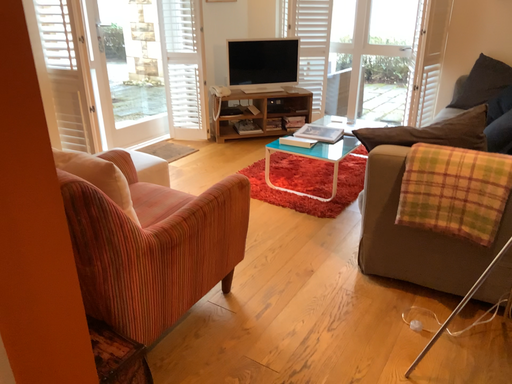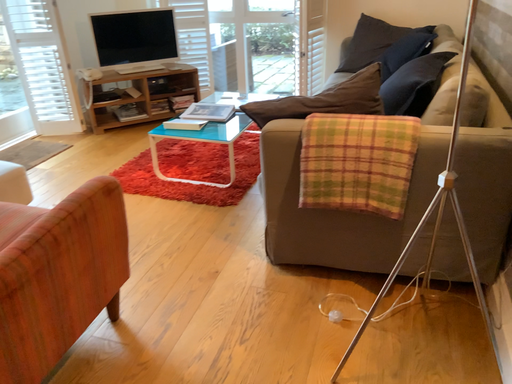
Question: How did the camera likely rotate when shooting the video?

Choices:
 (A) rotated right
 (B) rotated left

Answer: (A)